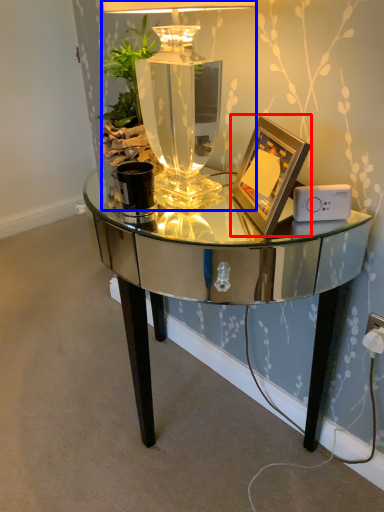
Question: Which of the following is the closest to the observer, picture frame (highlighted by a red box) or table lamp (highlighted by a blue box)?

Choices:
 (A) picture frame
 (B) table lamp

Answer: (B)